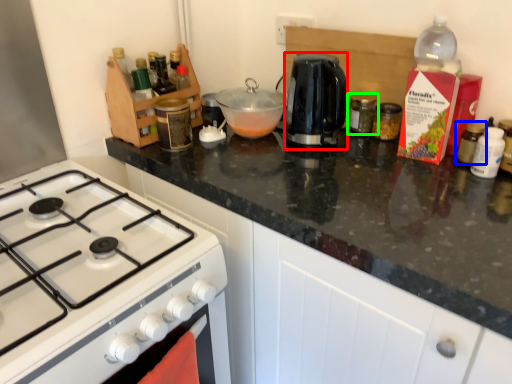
Question: Estimate the real-world distances between objects in this image. Which object is closer to kitchen appliance (highlighted by a red box), kitchen appliance (highlighted by a blue box) or kitchen appliance (highlighted by a green box)?

Choices:
 (A) kitchen appliance
 (B) kitchen appliance

Answer: (B)